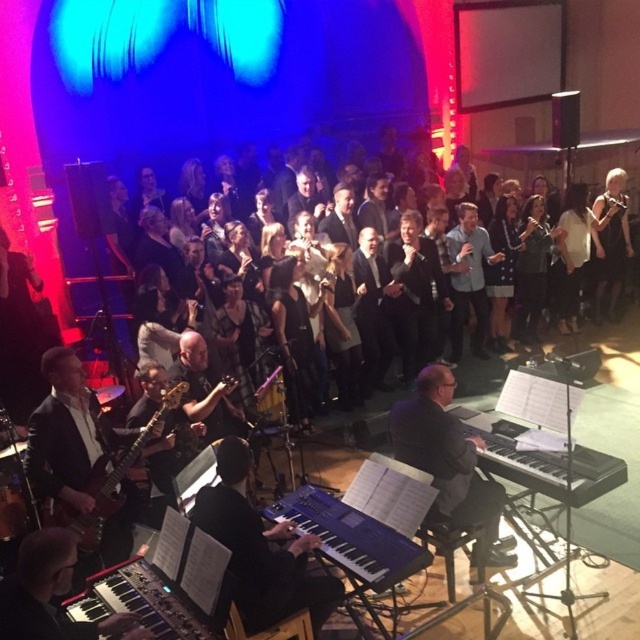
Question: Is blue matte keyboard at center wider than black matte keyboard at lower left?

Choices:
 (A) yes
 (B) no

Answer: (A)

Question: Is blue matte keyboard at center wider than black matte keyboard at lower left?

Choices:
 (A) no
 (B) yes

Answer: (B)

Question: Which is nearer to the dark gray suit at center?

Choices:
 (A) black matte keyboard at lower left
 (B) black matte keyboard at center

Answer: (B)

Question: Can you confirm if black matte keyboard at center is positioned below matte black electric guitar at lower left?

Choices:
 (A) yes
 (B) no

Answer: (B)

Question: Among these objects, which one is farthest from the camera?

Choices:
 (A) matte black electric guitar at lower left
 (B) black matte keyboard at lower left
 (C) blue matte keyboard at center
 (D) dark gray suit at center

Answer: (A)

Question: Which point is farther to the camera?

Choices:
 (A) dark gray suit at center
 (B) black matte keyboard at center

Answer: (A)